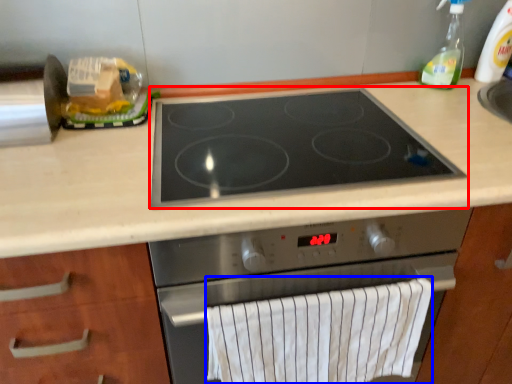
Question: Which object is closer to the camera taking this photo, gas stove (highlighted by a red box) or bath towel (highlighted by a blue box)?

Choices:
 (A) gas stove
 (B) bath towel

Answer: (A)